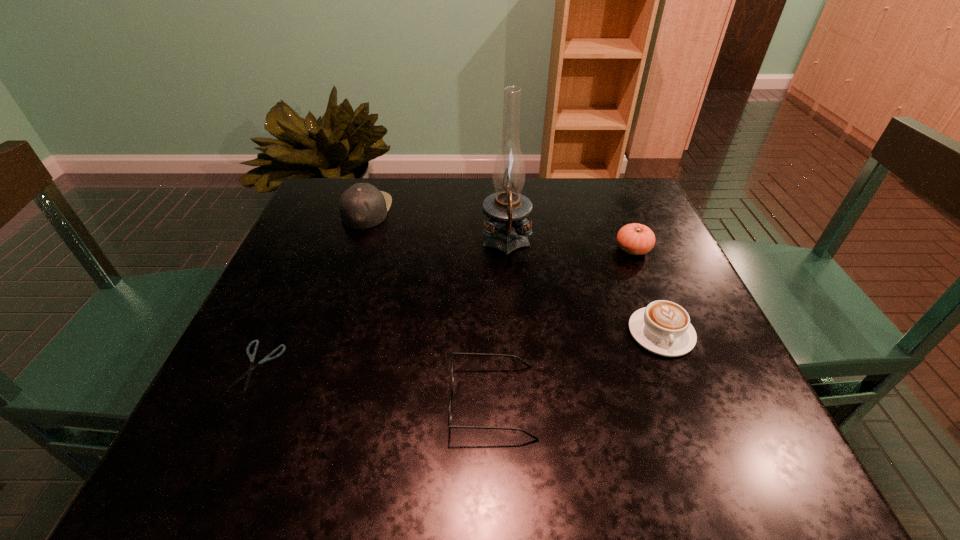
Find the location of a particular element. This screenshot has height=540, width=960. vacant area that lies between the cappuccino and the third tallest object is located at coordinates (647, 291).

Where is `free spot between the tomato and the cappuccino`? free spot between the tomato and the cappuccino is located at coordinates (647, 291).

This screenshot has height=540, width=960. What are the coordinates of `vacant area that lies between the cappuccino and the tomato` in the screenshot? It's located at (647, 291).

Locate an element on the screen. vacant area that lies between the third tallest object and the shortest object is located at coordinates (446, 308).

You are a GUI agent. You are given a task and a screenshot of the screen. Output one action in this format:
    pyautogui.click(x=<x>, y=<y>)
    Task: Click on the vacant area that lies between the spectacles and the second object from left to right
    This screenshot has width=960, height=540.
    Given the screenshot: What is the action you would take?
    pyautogui.click(x=429, y=306)

In order to click on free space between the tallest object and the shortest object in this screenshot , I will do `click(383, 304)`.

Identify the location of free spot between the third tallest object and the cappuccino. (647, 291).

Image resolution: width=960 pixels, height=540 pixels. Find the location of `free area in between the cappuccino and the cap`. free area in between the cappuccino and the cap is located at coordinates click(x=514, y=272).

Locate an element on the screen. This screenshot has height=540, width=960. free space between the tallest object and the spectacles is located at coordinates (499, 322).

Point out which object is positioned as the nearest to the tallest object. Please provide its 2D coordinates. Your answer should be formatted as a tuple, i.e. [(x, y)], where the tuple contains the x and y coordinates of a point satisfying the conditions above.

[(636, 239)]